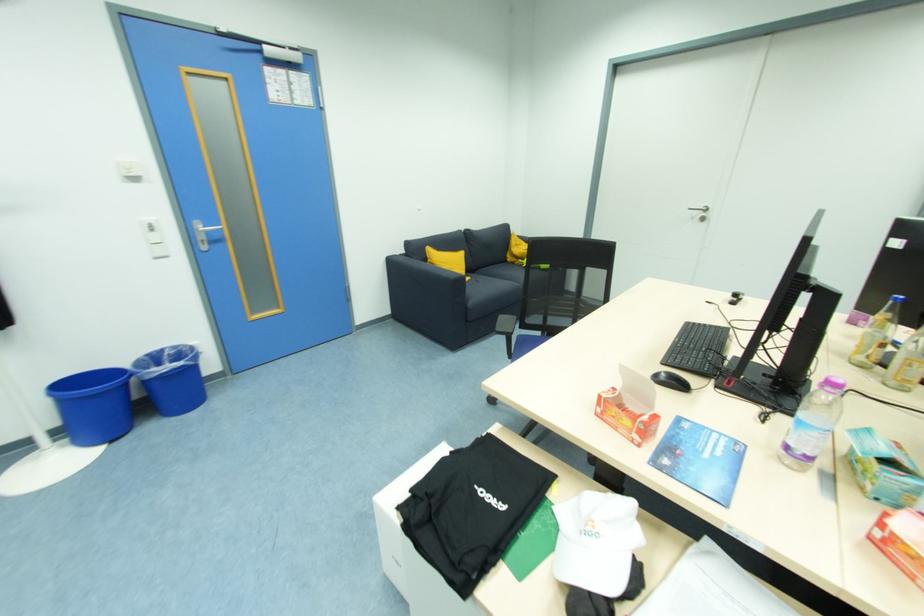
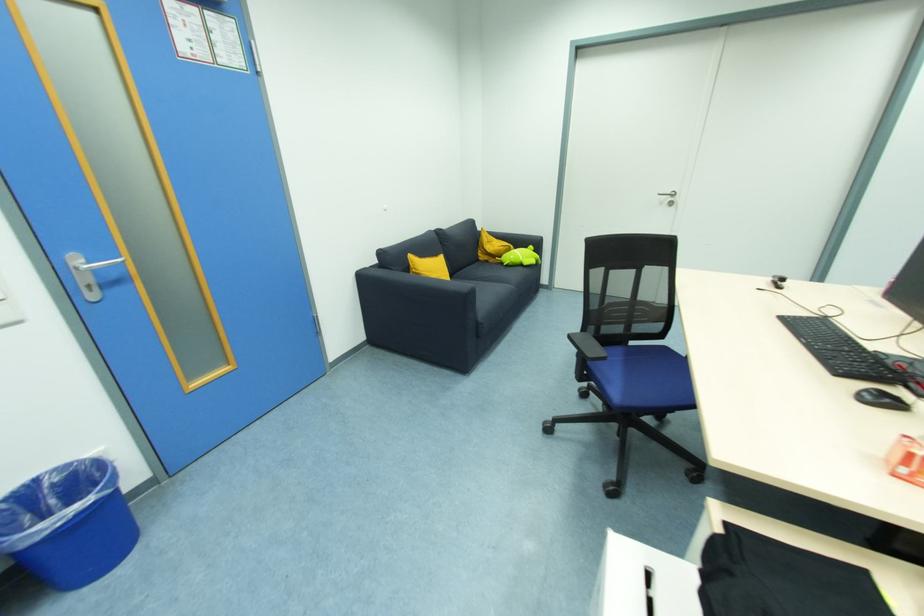
Question: The first image is from the beginning of the video and the second image is from the end. How did the camera likely rotate when shooting the video?

Choices:
 (A) Left
 (B) Right
 (C) Up
 (D) Down

Answer: (B)